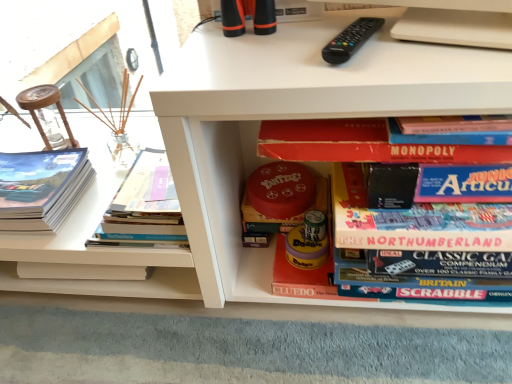
Locate an element on the screen. The width and height of the screenshot is (512, 384). vacant region to the right of black plastic remote at upper center is located at coordinates pyautogui.click(x=428, y=46).